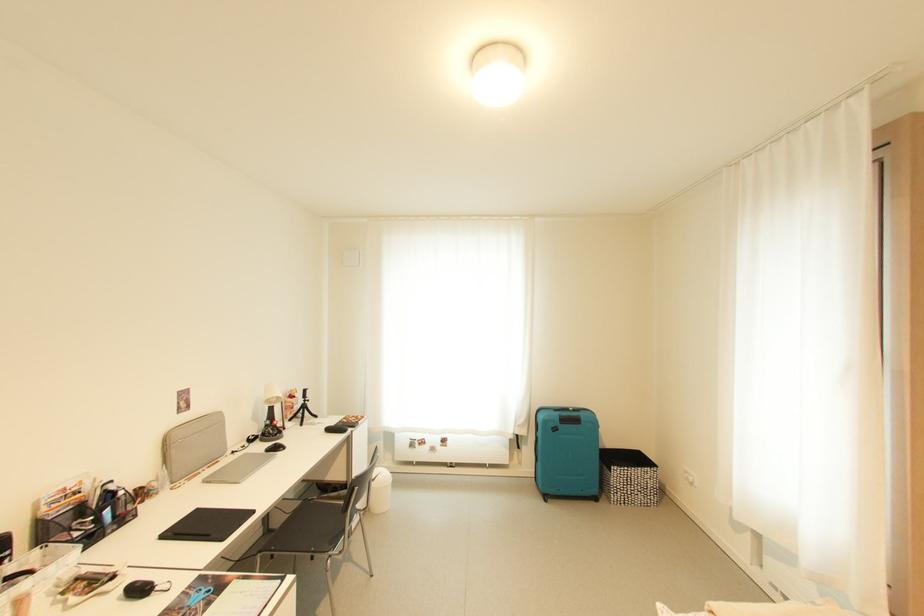
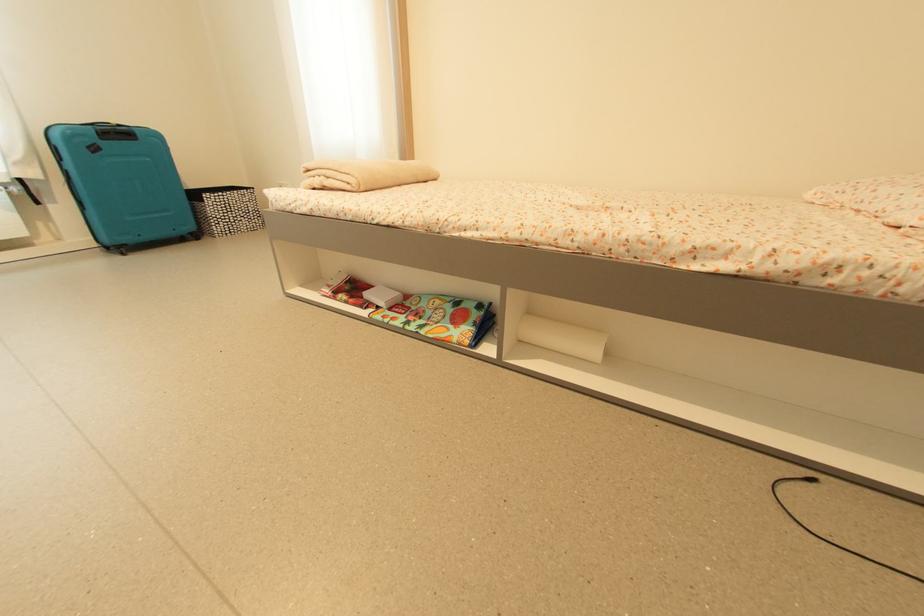
First-person continuous shooting, in which direction is the camera rotating?

The rotation direction of the camera is right-down.